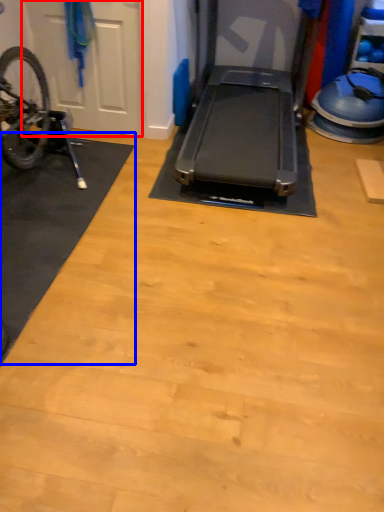
Question: Which point is further to the camera, garage door (highlighted by a red box) or mat (highlighted by a blue box)?

Choices:
 (A) garage door
 (B) mat

Answer: (A)